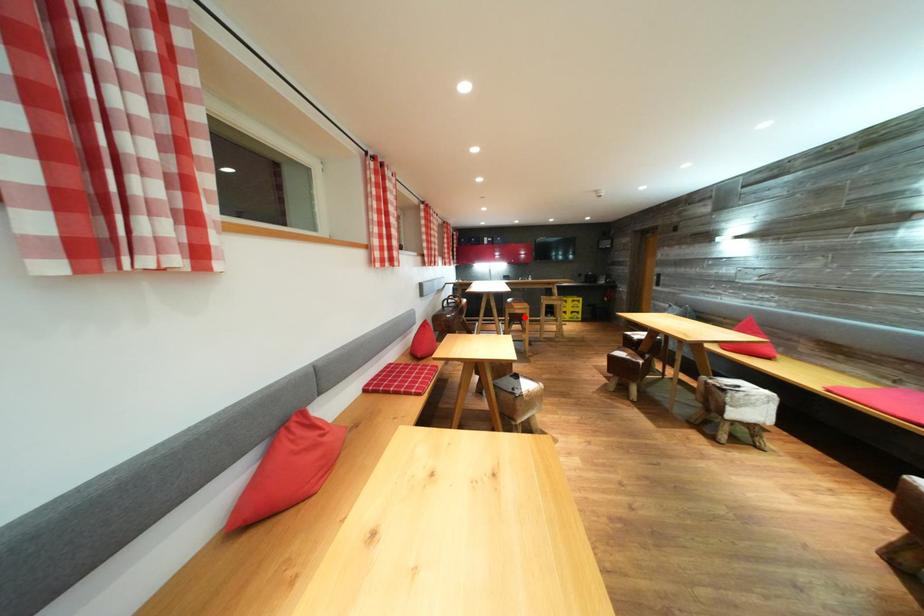
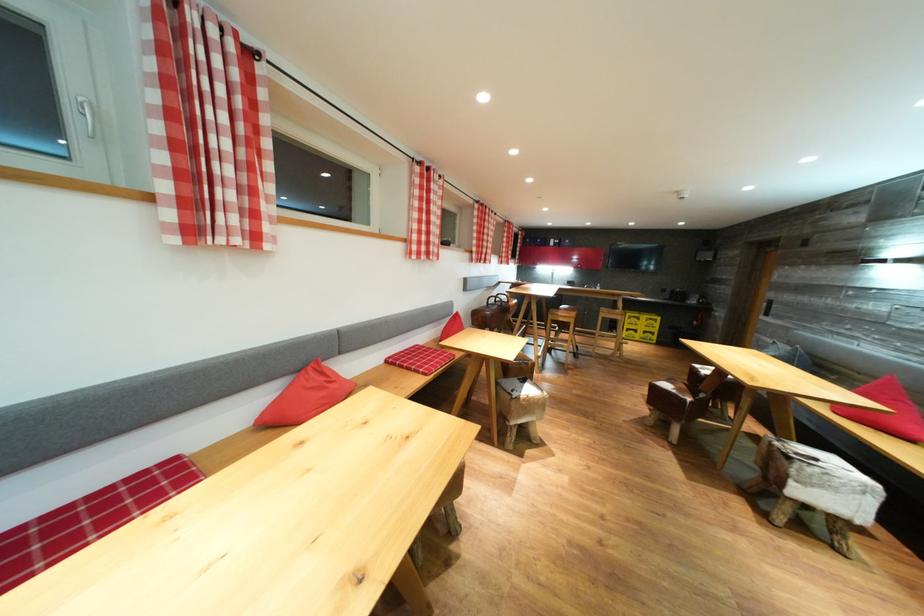
Find the pixel in the second image that matches the highlighted location in the first image.

(567, 325)